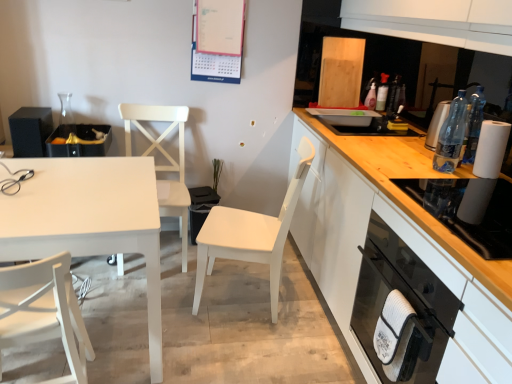
Locate an element on the screen. The width and height of the screenshot is (512, 384). blank area beneath white matte table at left (from a real-world perspective) is located at coordinates (108, 322).